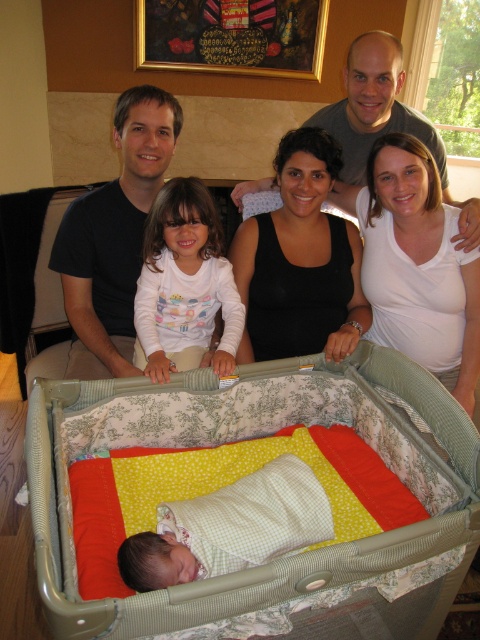
Question: Which of the following is the farthest from the observer?

Choices:
 (A) (186, 595)
 (B) (379, 301)
 (C) (139, 580)

Answer: (B)

Question: Which object appears closest to the camera in this image?

Choices:
 (A) white gingham swaddle at center
 (B) black sleeveless top at center

Answer: (A)

Question: Observing the image, what is the correct spatial positioning of black sleeveless top at center in reference to white soft shirt at center?

Choices:
 (A) left
 (B) right

Answer: (B)

Question: Is yellow dotted fabric at center below black sleeveless top at center?

Choices:
 (A) no
 (B) yes

Answer: (B)

Question: Is yellow dotted fabric at center to the left of black matte dress at center from the viewer's perspective?

Choices:
 (A) no
 (B) yes

Answer: (B)

Question: Among these points, which one is nearest to the camera?

Choices:
 (A) tap(404, 202)
 (B) tap(387, 90)
 (C) tap(289, 397)
 (D) tap(266, 467)

Answer: (D)